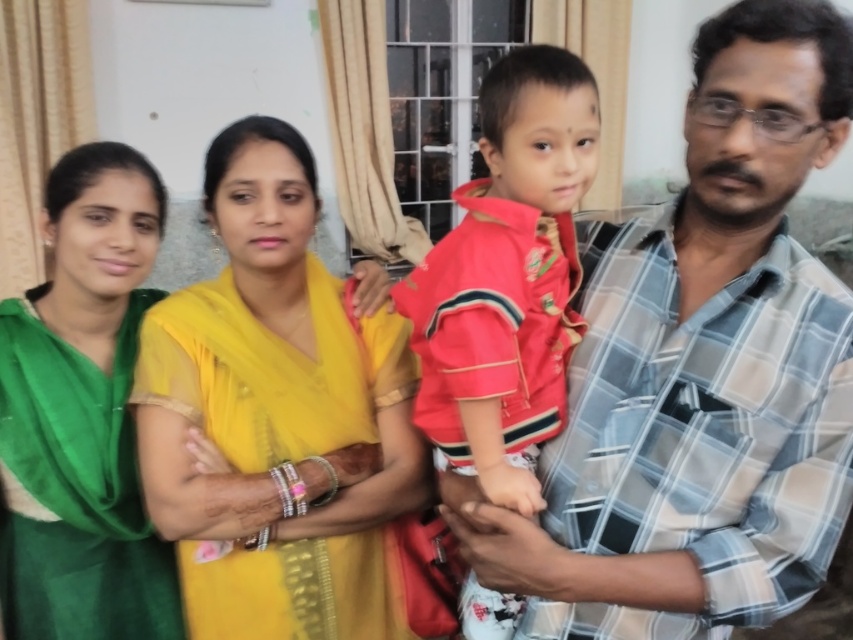
Question: Estimate the real-world distances between objects in this image. Which object is closer to the yellow sheer saree at center?

Choices:
 (A) plaid cotton shirt at center
 (B) red cotton shirt at center
 (C) green silk saree at upper left

Answer: (C)

Question: Among these objects, which one is nearest to the camera?

Choices:
 (A) red cotton shirt at center
 (B) green silk saree at upper left

Answer: (A)

Question: Where is plaid cotton shirt at center located in relation to yellow sheer saree at center in the image?

Choices:
 (A) above
 (B) below

Answer: (A)

Question: Is plaid cotton shirt at center below yellow sheer saree at center?

Choices:
 (A) no
 (B) yes

Answer: (A)

Question: Does yellow sheer saree at center have a smaller size compared to green silk saree at upper left?

Choices:
 (A) yes
 (B) no

Answer: (B)

Question: Which object appears closest to the camera in this image?

Choices:
 (A) plaid cotton shirt at center
 (B) green silk saree at upper left
 (C) yellow sheer saree at center

Answer: (A)